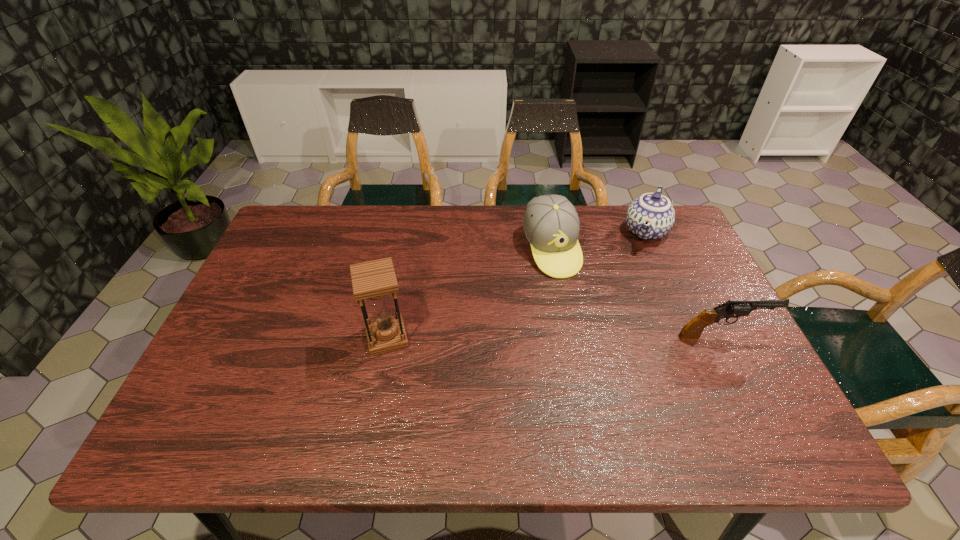
Identify the location of vacant point located between the tallest object and the chinaware. (516, 284).

Locate an element on the screen. Image resolution: width=960 pixels, height=540 pixels. free space between the baseball cap and the leftmost object is located at coordinates (468, 293).

Identify the location of free space that is in between the gun and the baseball cap. (636, 293).

Select which object appears as the closest to the second object from left to right. Please provide its 2D coordinates. Your answer should be formatted as a tuple, i.e. [(x, y)], where the tuple contains the x and y coordinates of a point satisfying the conditions above.

[(651, 216)]

Locate which object ranks in proximity to the hourglass. Please provide its 2D coordinates. Your answer should be formatted as a tuple, i.e. [(x, y)], where the tuple contains the x and y coordinates of a point satisfying the conditions above.

[(551, 224)]

At what (x,y) coordinates should I click in order to perform the action: click on vacant point that satisfies the following two spatial constraints: 1. on the front side of the gun; 2. along the barrel of the chinaware. Please return your answer as a coordinate pair (x, y). The width and height of the screenshot is (960, 540). Looking at the image, I should click on (691, 336).

Where is `blank space that satisfies the following two spatial constraints: 1. on the front side of the chinaware; 2. along the barrel of the gun`? blank space that satisfies the following two spatial constraints: 1. on the front side of the chinaware; 2. along the barrel of the gun is located at coordinates (691, 336).

In order to click on vacant region that satisfies the following two spatial constraints: 1. on the front side of the chinaware; 2. along the barrel of the gun in this screenshot , I will do `click(691, 336)`.

At what (x,y) coordinates should I click in order to perform the action: click on free spot that satisfies the following two spatial constraints: 1. on the back side of the chinaware; 2. on the left side of the baseball cap. Please return your answer as a coordinate pair (x, y). The width and height of the screenshot is (960, 540). Looking at the image, I should click on (547, 231).

The width and height of the screenshot is (960, 540). Identify the location of vacant region that satisfies the following two spatial constraints: 1. on the front side of the chinaware; 2. along the barrel of the gun. (691, 336).